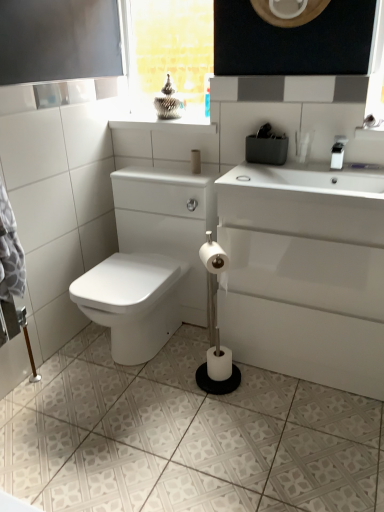
The image size is (384, 512). I want to click on free space on the front side of white matte soap at upper right, so pos(252,184).